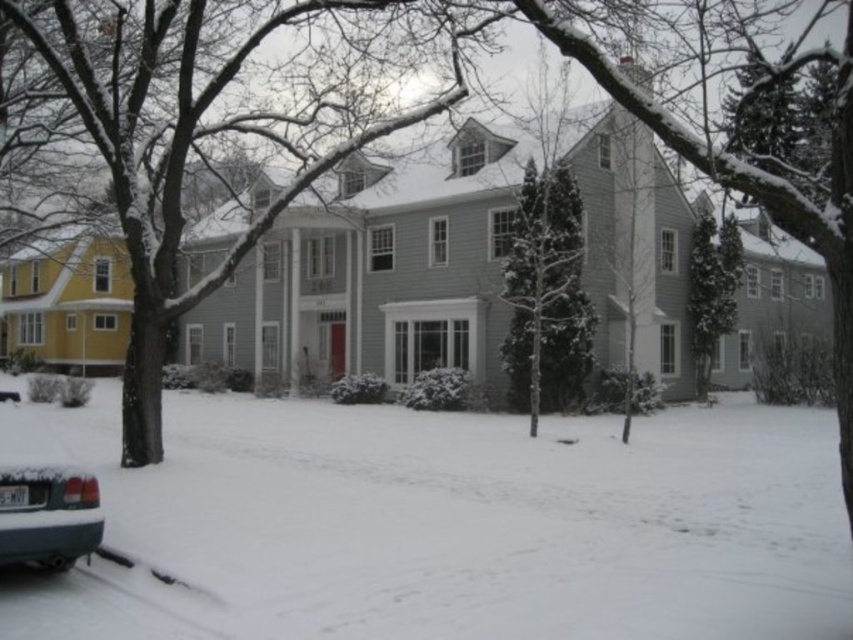
Question: Does white fluffy snow at lower left appear over snow-covered tree at center?

Choices:
 (A) yes
 (B) no

Answer: (B)

Question: Which point is farther to the camera?

Choices:
 (A) (532, 385)
 (B) (36, 554)
 (C) (316, 636)

Answer: (A)

Question: Is snow-covered evergreen tree at center wider than green textured evergreen tree at right?

Choices:
 (A) no
 (B) yes

Answer: (B)

Question: Which object is the closest to the green textured evergreen tree at right?

Choices:
 (A) metallic gray sedan at lower left
 (B) snow-covered tree at center

Answer: (B)

Question: Can you confirm if white fluffy snow at lower left is bigger than green textured evergreen tree at center?

Choices:
 (A) no
 (B) yes

Answer: (B)

Question: Which of the following is the closest to the observer?

Choices:
 (A) (849, 376)
 (B) (730, 284)
 (C) (86, 552)

Answer: (A)